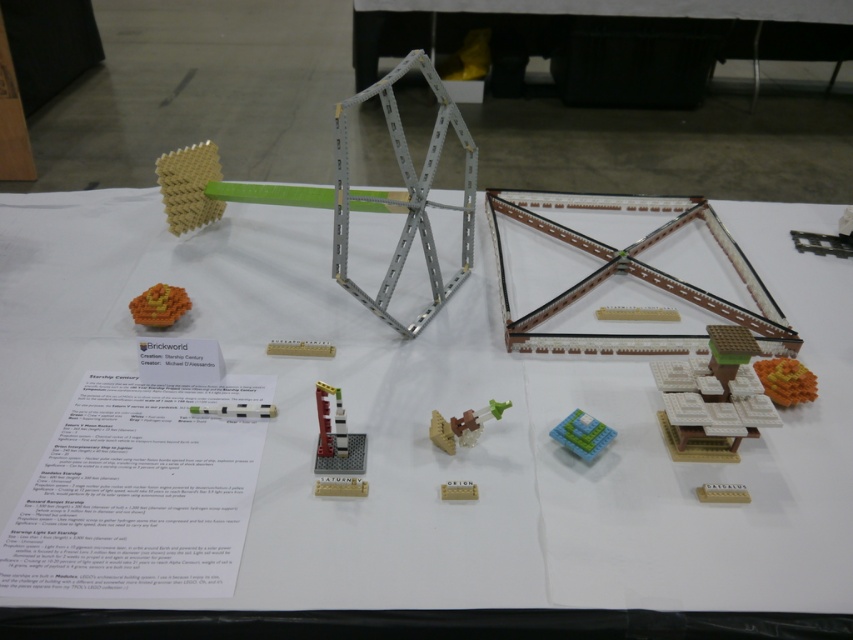
Question: Is white matte building at center right smaller than beige plastic brick at center?

Choices:
 (A) no
 (B) yes

Answer: (A)

Question: Can you confirm if brick red metallic satellite at center is bigger than blue matte cube at center?

Choices:
 (A) yes
 (B) no

Answer: (A)

Question: Based on their relative distances, which object is nearer to the blue matte cube at center?

Choices:
 (A) translucent plastic figure at center
 (B) orange matte cube at lower right
 (C) orange matte cube at center
 (D) brown matte bridge at center

Answer: (A)

Question: Which point is closer to the camera?

Choices:
 (A) (445, 483)
 (B) (218, 308)

Answer: (A)

Question: Does brick red metallic satellite at center lie in front of beige plastic brick at center?

Choices:
 (A) no
 (B) yes

Answer: (B)

Question: Which object is the farthest from the beige plastic brick at center?

Choices:
 (A) brown matte bridge at center
 (B) brick red metallic satellite at center
 (C) translucent plastic figure at center

Answer: (A)